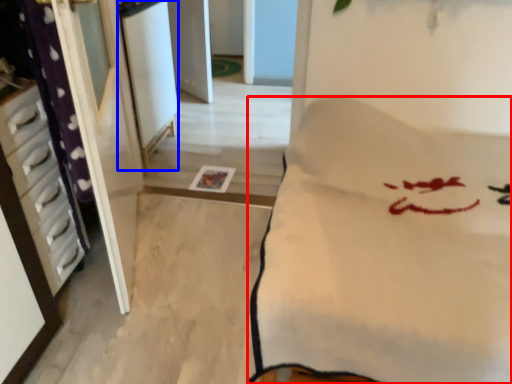
Question: Which of the following is the farthest to the observer, furniture (highlighted by a red box) or screen door (highlighted by a blue box)?

Choices:
 (A) furniture
 (B) screen door

Answer: (B)